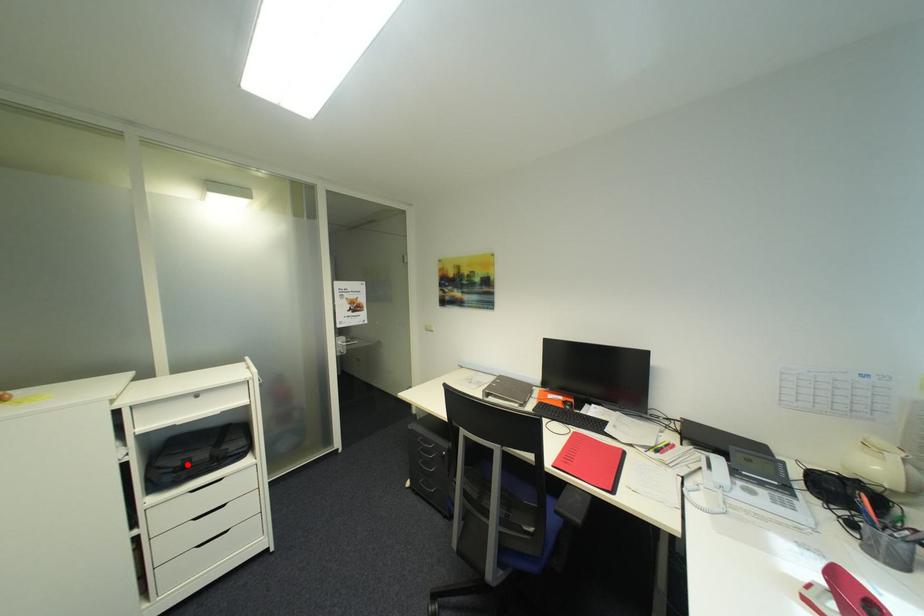
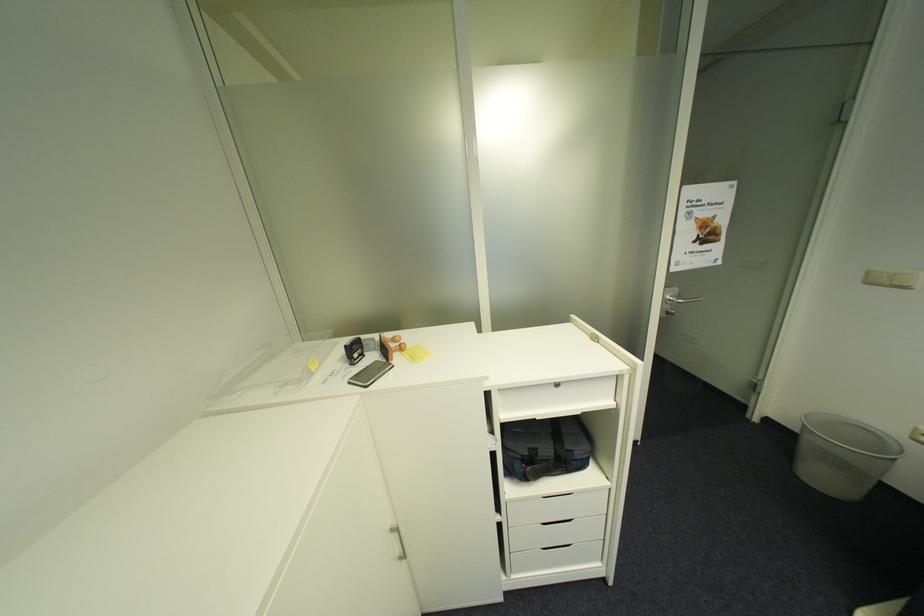
Locate, in the second image, the point that corresponds to the highlighted location in the first image.

(535, 454)